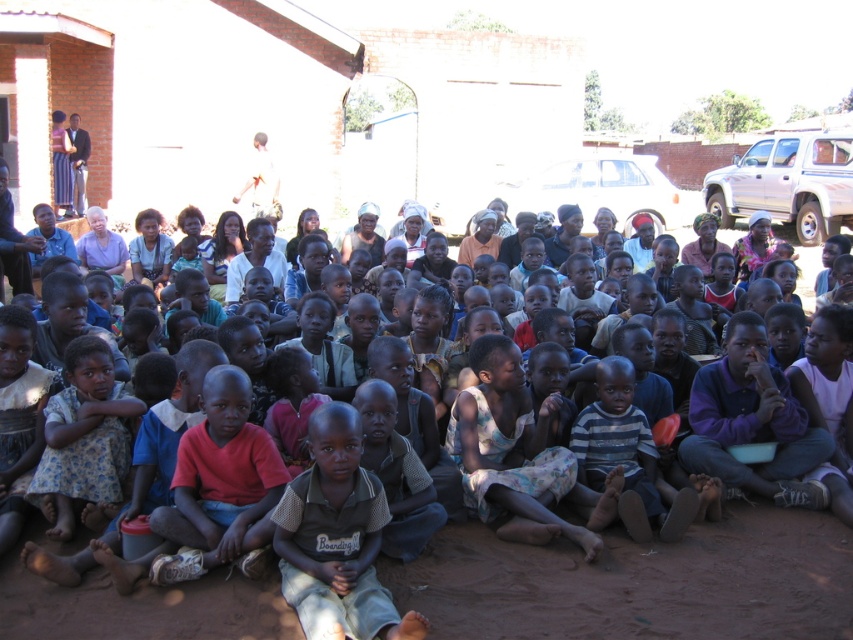
Question: Which object is closer to the camera taking this photo?

Choices:
 (A) light brown woven shirt at center
 (B) brown dirt field at center

Answer: (A)

Question: Can you confirm if brown dirt field at center is smaller than light brown woven shirt at center?

Choices:
 (A) yes
 (B) no

Answer: (A)

Question: Which point is farther from the camera taking this photo?

Choices:
 (A) (548, 554)
 (B) (399, 625)

Answer: (A)

Question: Is brown dirt field at center bigger than light brown woven shirt at center?

Choices:
 (A) yes
 (B) no

Answer: (B)

Question: Is brown dirt field at center to the left of light brown woven shirt at center from the viewer's perspective?

Choices:
 (A) no
 (B) yes

Answer: (A)

Question: Among these points, which one is farthest from the camera?

Choices:
 (A) (322, 545)
 (B) (508, 602)

Answer: (B)